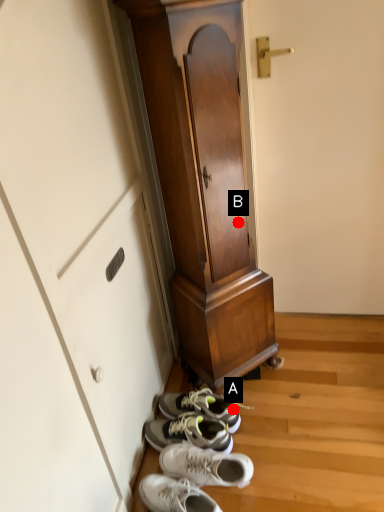
Question: Two points are circled on the image, labeled by A and B beside each circle. Among these points, which one is farthest from the camera?

Choices:
 (A) A is further
 (B) B is further

Answer: (A)